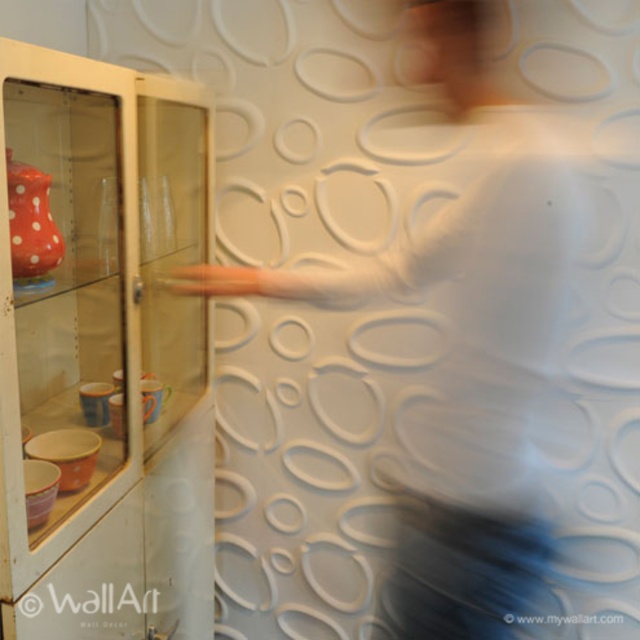
Is transparent glass cabinet at left closer to camera compared to white matte shirt at center?

Yes, transparent glass cabinet at left is closer to the viewer.

Which is above, transparent glass cabinet at left or white matte shirt at center?

white matte shirt at center is higher up.

Between point (188, 636) and point (324, 282), which one is positioned behind?

Point (188, 636)

At what (x,y) coordinates should I click in order to perform the action: click on transparent glass cabinet at left. Please return your answer as a coordinate pair (x, y). This screenshot has width=640, height=640. Looking at the image, I should click on (102, 352).